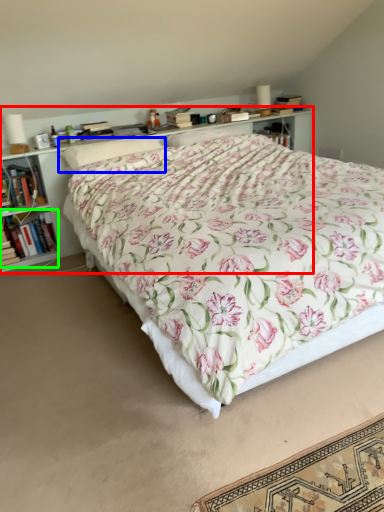
Question: Based on their relative distances, which object is nearer to shelf (highlighted by a red box)? Choose from pillow (highlighted by a blue box) and book (highlighted by a green box).

Choices:
 (A) pillow
 (B) book

Answer: (B)